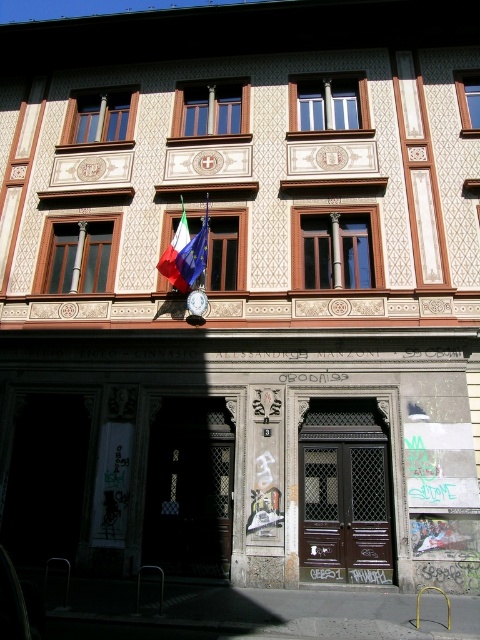
Question: Is matte wood window at upper left further to the viewer compared to polished metallic flag at center?

Choices:
 (A) no
 (B) yes

Answer: (B)

Question: Is brown wood window at upper left to the right of wooden frame at upper center from the viewer's perspective?

Choices:
 (A) no
 (B) yes

Answer: (A)

Question: Which point is closer to the camera?

Choices:
 (A) wooden frame at upper center
 (B) matte wood window at upper left

Answer: (A)

Question: Based on their relative distances, which object is farther from the wooden window at center?

Choices:
 (A) polished metallic flag at center
 (B) brown wood window at upper left

Answer: (B)

Question: Which object appears farthest from the camera in this image?

Choices:
 (A) white wooden window at center
 (B) brown wood window at upper left

Answer: (A)

Question: Is brown wood window at upper left behind wooden frame at upper center?

Choices:
 (A) yes
 (B) no

Answer: (B)